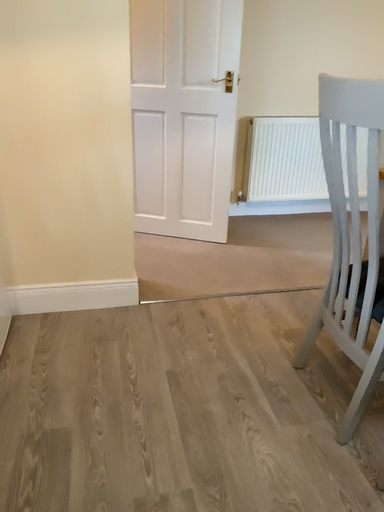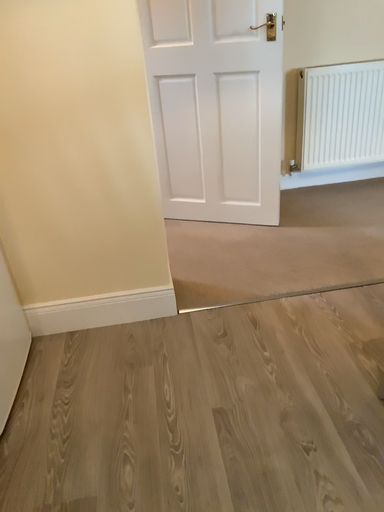
Question: Which way did the camera rotate in the video?

Choices:
 (A) rotated right
 (B) rotated left

Answer: (B)